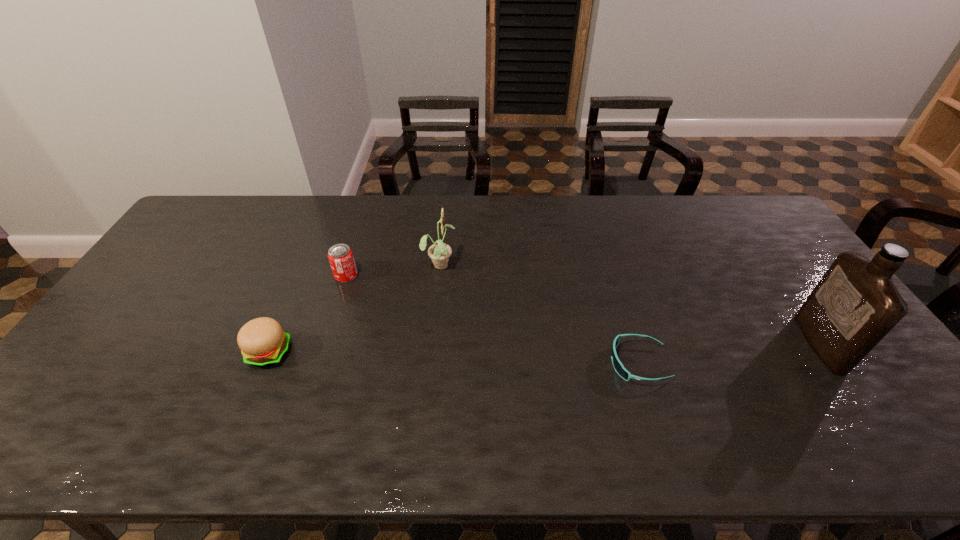
Find the location of a particular element. free space located 0.370m on the label side of the rightmost object is located at coordinates (669, 343).

Where is `vacant space located on the front-facing side of the sunflower`? This screenshot has height=540, width=960. vacant space located on the front-facing side of the sunflower is located at coordinates (516, 264).

Locate an element on the screen. vacant area situated on the back of the can is located at coordinates (368, 207).

Identify the location of vacant region located on the back of the hamburger. (309, 256).

Find the location of `vacant space located on the front-facing side of the sunglasses`. vacant space located on the front-facing side of the sunglasses is located at coordinates (481, 363).

At what (x,y) coordinates should I click in order to perform the action: click on vacant point located on the front-facing side of the sunglasses. Please return your answer as a coordinate pair (x, y). Looking at the image, I should click on [x=508, y=363].

At what (x,y) coordinates should I click in order to perform the action: click on vacant space located 0.060m on the front-facing side of the sunglasses. Please return your answer as a coordinate pair (x, y). The image size is (960, 540). Looking at the image, I should click on (587, 363).

The height and width of the screenshot is (540, 960). What are the coordinates of `object positioned at the right edge` in the screenshot? It's located at (855, 305).

This screenshot has width=960, height=540. In the image, there is a desktop. Identify the location of free region at the far edge. (579, 220).

The width and height of the screenshot is (960, 540). Find the location of `vacant space at the near edge of the desktop`. vacant space at the near edge of the desktop is located at coordinates (238, 449).